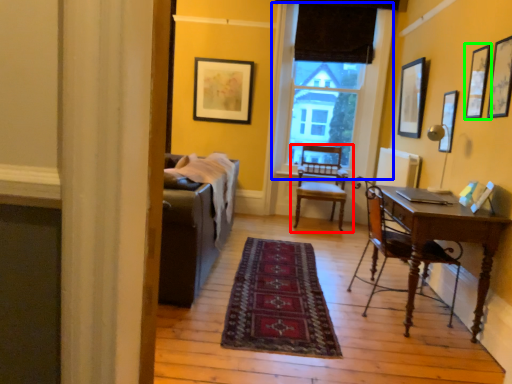
Question: Which object is the closest to the chair (highlighted by a red box)? Choose among these: window (highlighted by a blue box) or picture frame (highlighted by a green box).

Choices:
 (A) window
 (B) picture frame

Answer: (A)